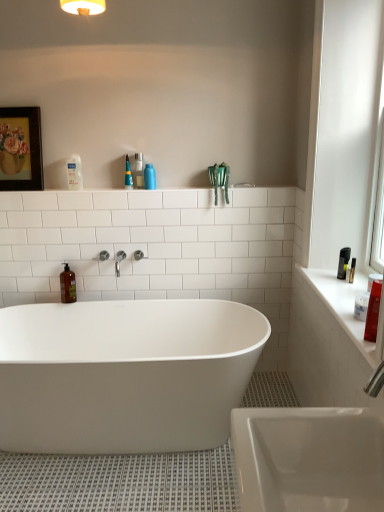
Question: Would you say brown matte bottle at left, the fourth cleaning product in the right-to-left sequence, is to the left or to the right of polished chrome faucet at center in the picture?

Choices:
 (A) right
 (B) left

Answer: (B)

Question: From the image's perspective, relative to polished chrome faucet at center, is brown matte bottle at left, the fourth cleaning product in the right-to-left sequence, above or below?

Choices:
 (A) below
 (B) above

Answer: (A)

Question: Based on their relative distances, which object is farther from the translucent plastic spray bottle at upper center, the second cleaning product from the left?

Choices:
 (A) white glossy bathtub at center
 (B) clear plastic bottle at upper left, which is the second toiletry from right to left
 (C) clear plastic bottle at upper center, acting as the 1th toiletry starting from the right
 (D) matte red bottle at right, which is counted as the fourth cleaning product, starting from the left
 (E) white glossy counter top at right

Answer: (D)

Question: Estimate the real-world distances between objects in this image. Which object is farther from the white glossy counter top at right?

Choices:
 (A) wooden framed painting at upper left
 (B) matte red bottle at right, placed as the first cleaning product when sorted from bottom to top
 (C) brown matte bottle at left, the fourth cleaning product in the right-to-left sequence
 (D) translucent plastic spray bottle at upper center, placed as the 3th cleaning product when sorted from right to left
 (E) blue matte bottle at upper center, which is counted as the third cleaning product, starting from the bottom

Answer: (A)